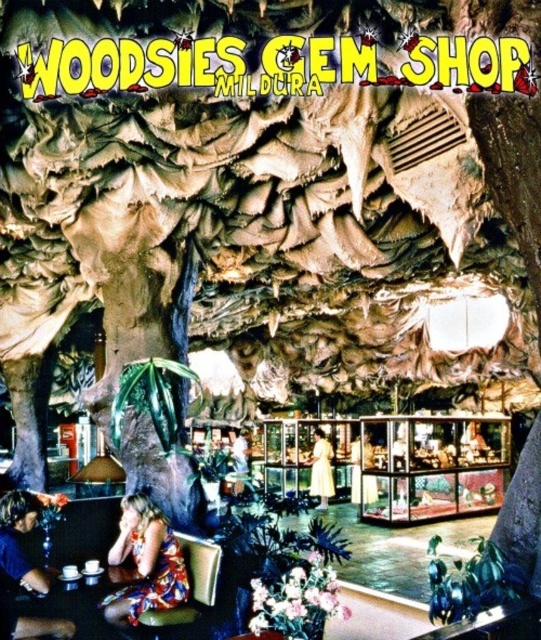
You are standing at point (5,570) and want to reach the exit located at point 0.011, 0.891 in the Woodies Gem Shop. The shop has a strict rule that you must walk in straight lines only. Can you reach the exit without deviating from this rule?

Yes, you can reach the exit by walking in a straight line from point (5,570) to point 0.011, 0.891 since there are no obstacles mentioned in the scene description that would block your path.

You are a customer in Woodies Gem Shop and you see the matte white dress at center and the white cotton shirt at center. Which one is narrower?

The matte white dress at center is narrower than the white cotton shirt at center.